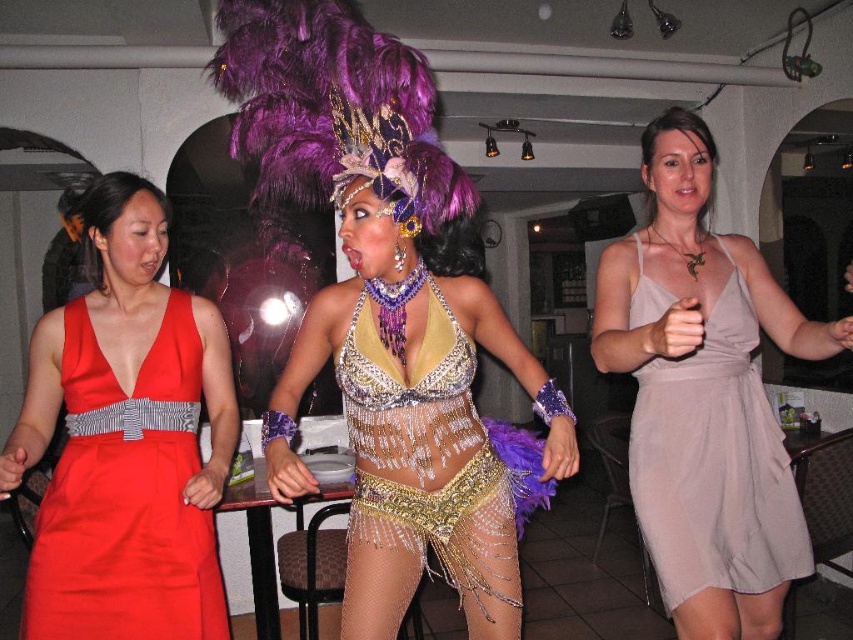
Between shiny metallic costume at center and shiny metallic belly dancer costume at center, which one appears on the right side from the viewer's perspective?

Positioned to the right is shiny metallic costume at center.

How far apart are shiny metallic costume at center and shiny metallic belly dancer costume at center?

They are 1.92 inches apart.

Does point (354, 196) lie behind point (347, 372)?

No, it is in front of (347, 372).

At what (x,y) coordinates should I click in order to perform the action: click on shiny metallic costume at center. Please return your answer as a coordinate pair (x, y). This screenshot has width=853, height=640. Looking at the image, I should click on (419, 420).

Who is taller, matte beige dress at center or shiny metallic belly dancer costume at center?

With more height is matte beige dress at center.

Describe the element at coordinates (704, 396) in the screenshot. I see `matte beige dress at center` at that location.

What are the coordinates of `matte beige dress at center` in the screenshot? It's located at (704, 396).

Can you confirm if shiny metallic costume at center is positioned to the left of satin red dress at left?

Incorrect, shiny metallic costume at center is not on the left side of satin red dress at left.

Can you confirm if shiny metallic costume at center is thinner than satin red dress at left?

No.

Locate an element on the screen. The height and width of the screenshot is (640, 853). shiny metallic costume at center is located at coordinates (419, 420).